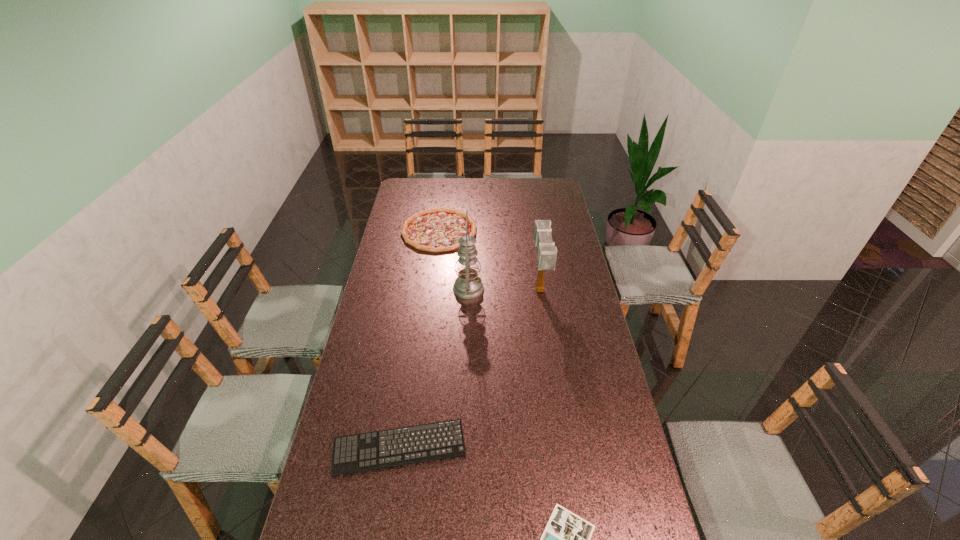
The image size is (960, 540). What are the coordinates of `free space between the fourth shortest object and the computer keyboard` in the screenshot? It's located at (469, 369).

The width and height of the screenshot is (960, 540). Find the location of `object that is the third closest to the nearest object`. object that is the third closest to the nearest object is located at coordinates (468, 285).

You are a GUI agent. You are given a task and a screenshot of the screen. Output one action in this format:
    pyautogui.click(x=<x>, y=<y>)
    Task: Click on the closest object relative to the fourth tallest object
    This screenshot has height=540, width=960.
    Given the screenshot: What is the action you would take?
    coord(566,538)

Find the location of a particular element. This screenshot has width=960, height=540. free point that satisfies the following two spatial constraints: 1. on the front side of the oil lamp; 2. on the left side of the fourth shortest object is located at coordinates (468, 292).

Identify the location of vacant region that satisfies the following two spatial constraints: 1. on the back side of the second nearest object; 2. on the right side of the oil lamp. The width and height of the screenshot is (960, 540). (422, 289).